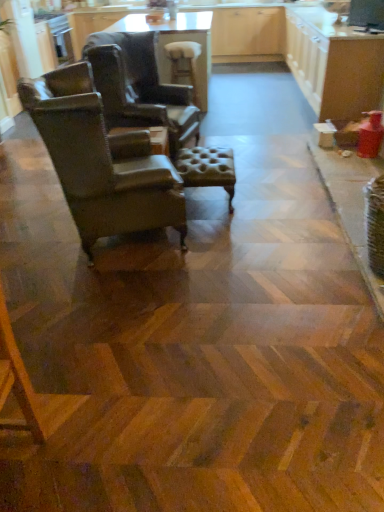
Question: Is tufted leather ottoman at center, which is the 1th bar stool in front-to-back order, in front of or behind wooden glossy table at upper center in the image?

Choices:
 (A) behind
 (B) front

Answer: (B)

Question: From their relative heights in the image, would you say tufted leather ottoman at center, which ranks as the 2th bar stool in back-to-front order, is taller or shorter than wooden glossy table at upper center?

Choices:
 (A) short
 (B) tall

Answer: (A)

Question: Which object is the closest to the tufted leather ottoman at center, the second bar stool viewed from the top?

Choices:
 (A) brown leather chair at left, the first chair from the front
 (B) white glossy cabinets at upper right
 (C) wooden glossy table at upper center
 (D) white fabric bar stool at center, marked as the 1th bar stool in a back-to-front arrangement
 (E) leather wingback chair at left, the 1th chair from the back

Answer: (E)

Question: Estimate the real-world distances between objects in this image. Which object is closer to the white glossy cabinets at upper right?

Choices:
 (A) brown leather chair at left, placed as the second chair when sorted from back to front
 (B) wooden glossy table at upper center
 (C) white fabric bar stool at center, which is the first bar stool in top-to-bottom order
 (D) tufted leather ottoman at center, the second bar stool viewed from the top
 (E) leather wingback chair at left, the 1th chair from the back

Answer: (C)